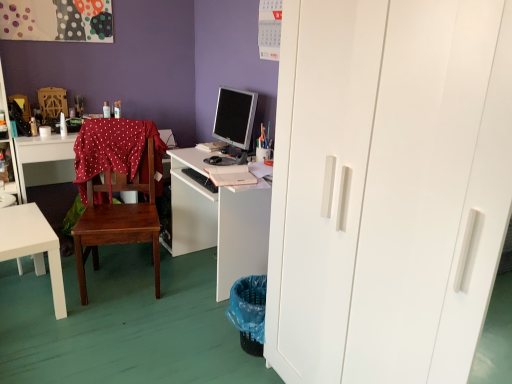
This screenshot has width=512, height=384. I want to click on vacant space in front of white matte desk at center, positioned as the 3th desk in left-to-right order, so click(183, 341).